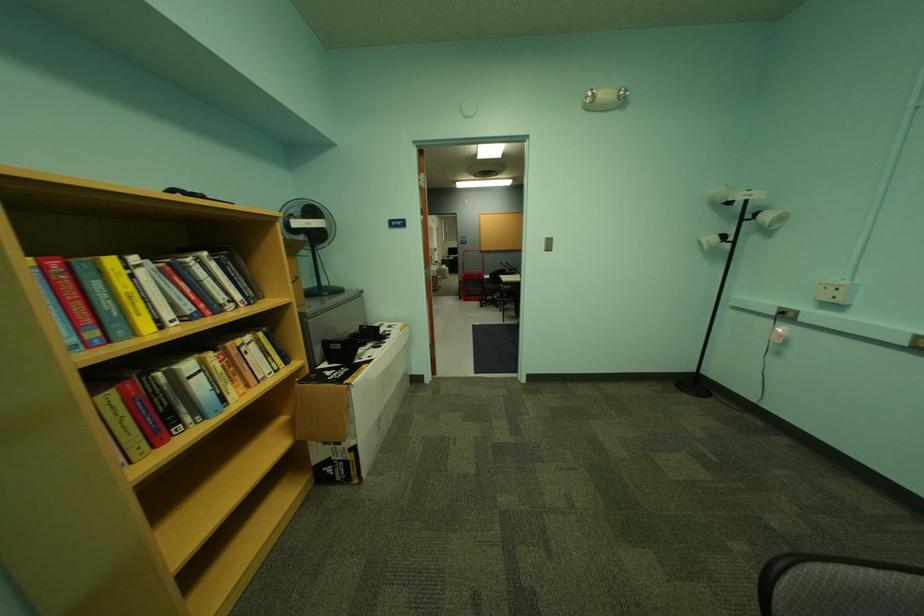
Describe the element at coordinates (470, 252) in the screenshot. I see `a red cart handle` at that location.